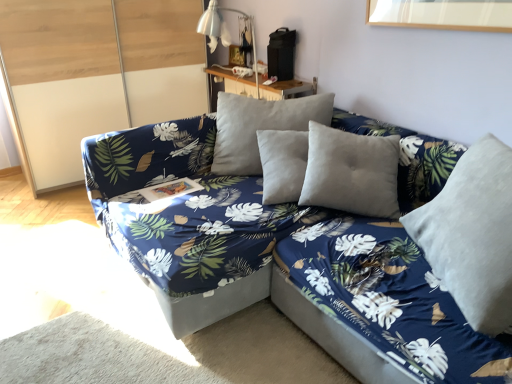
The image size is (512, 384). What do you see at coordinates (284, 89) in the screenshot? I see `wooden table at upper center` at bounding box center [284, 89].

What are the coordinates of `velvet gray pillow at right` in the screenshot? It's located at (472, 235).

The width and height of the screenshot is (512, 384). I want to click on transparent glass door at left, so click(60, 83).

How different are the orientations of velvet blue bed frame at center and transparent glass door at left in degrees?

The facing directions of velvet blue bed frame at center and transparent glass door at left are 90.6 degrees apart.

I want to click on bed frame that is below the transparent glass door at left (from the image's perspective), so click(x=391, y=299).

Which is in front, point (437, 280) or point (110, 104)?

Positioned in front is point (437, 280).

From the image's perspective, is velvet blue bed frame at center on transparent glass door at left?

Incorrect, from the image's perspective, velvet blue bed frame at center is lower than transparent glass door at left.

Is wooden table at upper center in contact with metallic silver table lamp at upper center?

wooden table at upper center is not next to metallic silver table lamp at upper center, and they're not touching.

Considering the relative sizes of wooden table at upper center and metallic silver table lamp at upper center in the image provided, is wooden table at upper center thinner than metallic silver table lamp at upper center?

Yes.

Does wooden table at upper center turn towards metallic silver table lamp at upper center?

No, wooden table at upper center is not oriented towards metallic silver table lamp at upper center.

Is wooden table at upper center behind metallic silver table lamp at upper center?

Yes, wooden table at upper center is further from the viewer.

Based on the photo, is velvet gray pillow at right a part of transparent glass door at left?

No, velvet gray pillow at right is not surrounded by transparent glass door at left.

From the image's perspective, which is below, transparent glass door at left or velvet gray pillow at right?

velvet gray pillow at right.

Between wooden table at upper center and transparent glass door at left, which one appears on the left side from the viewer's perspective?

transparent glass door at left is more to the left.

How distant is wooden table at upper center from transparent glass door at left?

They are 1.15 meters apart.

Can you confirm if wooden table at upper center is wider than transparent glass door at left?

No, wooden table at upper center is not wider than transparent glass door at left.

From the picture: Is transparent glass door at left located within wooden table at upper center?

Actually, transparent glass door at left is outside wooden table at upper center.

Consider the image. In terms of width, does velvet gray pillow at right look wider or thinner when compared to wooden table at upper center?

velvet gray pillow at right is wider than wooden table at upper center.

Which is farther, (426, 231) or (238, 90)?

The point (238, 90) is farther.

Considering the positions of objects velvet gray pillow at right and wooden table at upper center in the image provided, who is more to the left, velvet gray pillow at right or wooden table at upper center?

Positioned to the left is wooden table at upper center.

Does velvet gray pillow at right have a greater height compared to wooden table at upper center?

Indeed, velvet gray pillow at right has a greater height compared to wooden table at upper center.

Are transparent glass door at left and wooden table at upper center located far from each other?

Yes, transparent glass door at left and wooden table at upper center are quite far apart.

Can we say transparent glass door at left lies outside wooden table at upper center?

transparent glass door at left is positioned outside wooden table at upper center.

How distant is transparent glass door at left from wooden table at upper center?

transparent glass door at left and wooden table at upper center are 1.15 meters apart.

From the image's perspective, is transparent glass door at left positioned above or below wooden table at upper center?

Clearly, from the image's perspective, transparent glass door at left is above wooden table at upper center.

How much distance is there between metallic silver table lamp at upper center and velvet gray pillow at right?

The distance of metallic silver table lamp at upper center from velvet gray pillow at right is 1.89 meters.

Looking at this image, is metallic silver table lamp at upper center taller or shorter than velvet gray pillow at right?

metallic silver table lamp at upper center is taller than velvet gray pillow at right.

Considering the sizes of metallic silver table lamp at upper center and velvet gray pillow at right in the image, is metallic silver table lamp at upper center wider or thinner than velvet gray pillow at right?

In the image, metallic silver table lamp at upper center appears to be wider than velvet gray pillow at right.

Between point (250, 18) and point (479, 150), which one is positioned in front?

The point (479, 150) is more forward.

Locate an element on the screen. This screenshot has width=512, height=384. bed frame in front of the transparent glass door at left is located at coordinates (391, 299).

Locate an element on the screen. This screenshot has width=512, height=384. table lamp that is on the left side of wooden table at upper center is located at coordinates (223, 28).

Considering their positions, is wooden table at upper center positioned closer to blue fabric couch at center than velvet gray pillow at right?

velvet gray pillow at right is positioned closer to the anchor blue fabric couch at center.

Based on their spatial positions, is velvet gray pillow at right or metallic silver table lamp at upper center closer to wooden table at upper center?

metallic silver table lamp at upper center is closer to wooden table at upper center.

When comparing their distances from blue fabric couch at center, does velvet blue bed frame at center or metallic silver table lamp at upper center seem further?

Among the two, metallic silver table lamp at upper center is located further to blue fabric couch at center.

Which object lies nearer to the anchor point wooden table at upper center, velvet blue bed frame at center or transparent glass door at left?

Among the two, transparent glass door at left is located nearer to wooden table at upper center.

Which object lies nearer to the anchor point transparent glass door at left, velvet gray pillow at right or velvet blue bed frame at center?

velvet blue bed frame at center.

When comparing their distances from velvet blue bed frame at center, does metallic silver table lamp at upper center or velvet gray pillow at right seem closer?

Based on the image, velvet gray pillow at right appears to be nearer to velvet blue bed frame at center.

From the image, which object appears to be farther from wooden table at upper center, velvet blue bed frame at center or velvet gray pillow at right?

The object further to wooden table at upper center is velvet gray pillow at right.

Considering their positions, is wooden table at upper center positioned further to transparent glass door at left than velvet blue bed frame at center?

Based on the image, velvet blue bed frame at center appears to be further to transparent glass door at left.

Image resolution: width=512 pixels, height=384 pixels. In order to click on table lamp between transparent glass door at left and blue fabric couch at center in this screenshot , I will do `click(223, 28)`.

Where is `table lamp located between blue fabric couch at center and wooden table at upper center in the depth direction`? This screenshot has height=384, width=512. table lamp located between blue fabric couch at center and wooden table at upper center in the depth direction is located at coordinates (223, 28).

At what (x,y) coordinates should I click in order to perform the action: click on bed frame between transparent glass door at left and velvet gray pillow at right from left to right. Please return your answer as a coordinate pair (x, y). This screenshot has height=384, width=512. Looking at the image, I should click on (391, 299).

Image resolution: width=512 pixels, height=384 pixels. Identify the location of table lamp between velvet blue bed frame at center and wooden table at upper center from front to back. (223, 28).